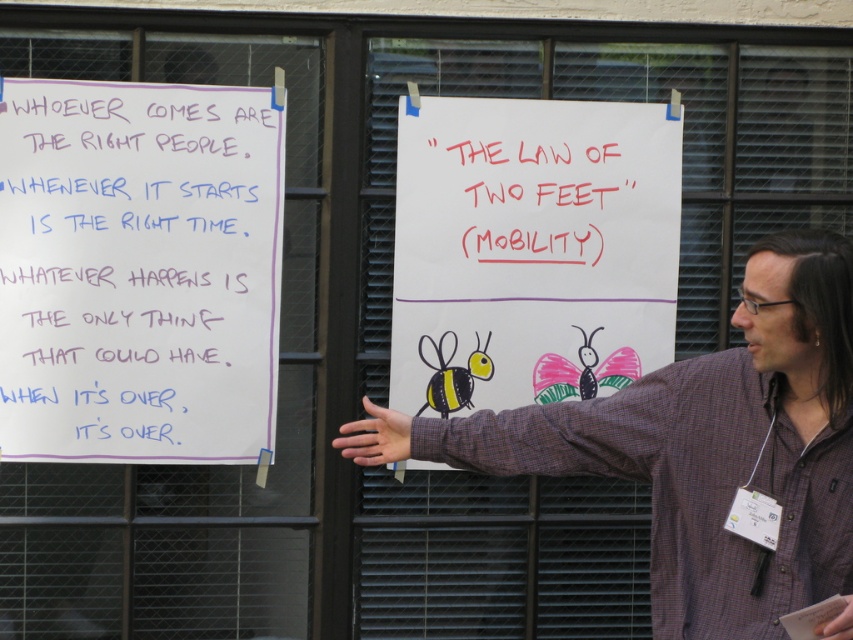
What do you see at coordinates (138, 272) in the screenshot?
I see `white paper at left` at bounding box center [138, 272].

Between point (3, 308) and point (610, 195), which one is positioned in front?

Positioned in front is point (3, 308).

Identify the location of white paper at left. Image resolution: width=853 pixels, height=640 pixels. (138, 272).

What do you see at coordinates (138, 272) in the screenshot?
I see `white paper at left` at bounding box center [138, 272].

Is white paper at left wider than plaid shirt at center?

Incorrect, white paper at left's width does not surpass plaid shirt at center's.

Where is `white paper at left`? white paper at left is located at coordinates pos(138,272).

In order to click on white paper at left in this screenshot , I will do `click(138, 272)`.

Who is shorter, matte white paper at center or red marker text at upper center?

With less height is red marker text at upper center.

Who is more distant from viewer, (676, 216) or (473, 144)?

Positioned behind is point (676, 216).

Who is more distant from viewer, (x=517, y=173) or (x=480, y=180)?

Point (x=517, y=173)

This screenshot has width=853, height=640. I want to click on matte white paper at center, so click(x=531, y=250).